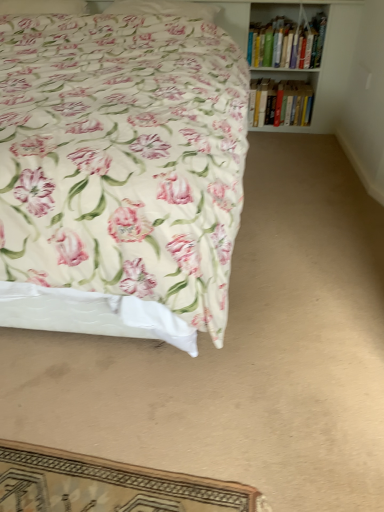
Question: Considering the relative positions of hardcover books at upper right, arranged as the first book when ordered from the bottom, and hardcover books at upper right, acting as the 1th book starting from the top, in the image provided, is hardcover books at upper right, arranged as the first book when ordered from the bottom, in front of hardcover books at upper right, acting as the 1th book starting from the top,?

Choices:
 (A) yes
 (B) no

Answer: (B)

Question: Does hardcover books at upper right, the 2th book viewed from the top, have a lesser width compared to hardcover books at upper right, acting as the 1th book starting from the top?

Choices:
 (A) yes
 (B) no

Answer: (A)

Question: Is hardcover books at upper right, arranged as the first book when ordered from the bottom, touching hardcover books at upper right, acting as the 1th book starting from the top?

Choices:
 (A) yes
 (B) no

Answer: (B)

Question: Is the depth of hardcover books at upper right, arranged as the first book when ordered from the bottom, greater than that of hardcover books at upper right, acting as the 1th book starting from the top?

Choices:
 (A) yes
 (B) no

Answer: (A)

Question: Is hardcover books at upper right, arranged as the first book when ordered from the bottom, positioned beyond the bounds of hardcover books at upper right, acting as the 1th book starting from the top?

Choices:
 (A) yes
 (B) no

Answer: (A)

Question: Considering their positions, is floral fabric pillow at upper center, the 2th pillow from the left, located in front of or behind floral fabric pillow at upper left, the second pillow in the right-to-left sequence?

Choices:
 (A) front
 (B) behind

Answer: (B)

Question: Considering the positions of floral fabric pillow at upper center, the first pillow viewed from the right, and floral fabric pillow at upper left, arranged as the 1th pillow when viewed from the left, in the image, is floral fabric pillow at upper center, the first pillow viewed from the right, bigger or smaller than floral fabric pillow at upper left, arranged as the 1th pillow when viewed from the left,?

Choices:
 (A) small
 (B) big

Answer: (B)

Question: From the image's perspective, relative to floral fabric pillow at upper left, the second pillow in the right-to-left sequence, is floral fabric pillow at upper center, the 2th pillow from the left, above or below?

Choices:
 (A) below
 (B) above

Answer: (A)

Question: Based on their positions, is floral fabric pillow at upper center, the 2th pillow from the left, located to the left or right of floral fabric pillow at upper left, arranged as the 1th pillow when viewed from the left?

Choices:
 (A) right
 (B) left

Answer: (A)

Question: From a real-world perspective, relative to floral fabric pillow at upper center, the first pillow viewed from the right, is floral fabric pillow at upper left, the second pillow in the right-to-left sequence, vertically above or below?

Choices:
 (A) below
 (B) above

Answer: (B)

Question: Based on their positions, is floral fabric pillow at upper left, arranged as the 1th pillow when viewed from the left, located to the left or right of floral fabric pillow at upper center, the first pillow viewed from the right?

Choices:
 (A) right
 (B) left

Answer: (B)

Question: Looking at the image, does floral fabric pillow at upper left, arranged as the 1th pillow when viewed from the left, seem bigger or smaller compared to floral fabric pillow at upper center, the first pillow viewed from the right?

Choices:
 (A) small
 (B) big

Answer: (A)

Question: Looking at their shapes, would you say floral fabric pillow at upper left, arranged as the 1th pillow when viewed from the left, is wider or thinner than floral fabric pillow at upper center, the 2th pillow from the left?

Choices:
 (A) wide
 (B) thin

Answer: (A)

Question: From the image's perspective, is floral fabric pillow at upper center, the first pillow viewed from the right, positioned above or below hardcover books at upper right, arranged as the first book when ordered from the bottom?

Choices:
 (A) below
 (B) above

Answer: (B)

Question: From a real-world perspective, relative to hardcover books at upper right, the 2th book viewed from the top, is floral fabric pillow at upper center, the 2th pillow from the left, vertically above or below?

Choices:
 (A) below
 (B) above

Answer: (B)